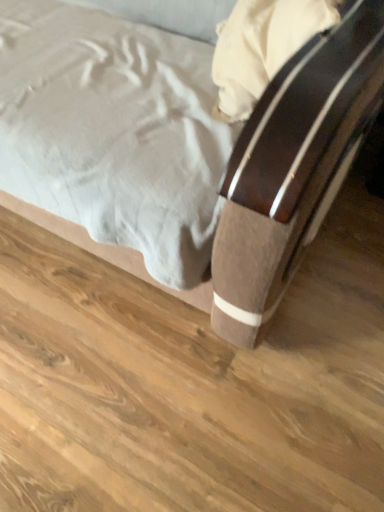
Question: Relative to matte brown bed at center, is brown wood bed frame at lower center in front or behind?

Choices:
 (A) behind
 (B) front

Answer: (A)

Question: From the image's perspective, is brown wood bed frame at lower center positioned above or below matte brown bed at center?

Choices:
 (A) below
 (B) above

Answer: (A)

Question: Based on their positions, is brown wood bed frame at lower center located to the left or right of matte brown bed at center?

Choices:
 (A) left
 (B) right

Answer: (B)

Question: Is matte brown bed at center situated inside brown wood bed frame at lower center or outside?

Choices:
 (A) inside
 (B) outside

Answer: (B)

Question: Would you say matte brown bed at center is to the left or to the right of brown wood bed frame at lower center in the picture?

Choices:
 (A) left
 (B) right

Answer: (A)

Question: From the image's perspective, is matte brown bed at center positioned above or below brown wood bed frame at lower center?

Choices:
 (A) below
 (B) above

Answer: (B)

Question: Is matte brown bed at center bigger or smaller than brown wood bed frame at lower center?

Choices:
 (A) big
 (B) small

Answer: (A)